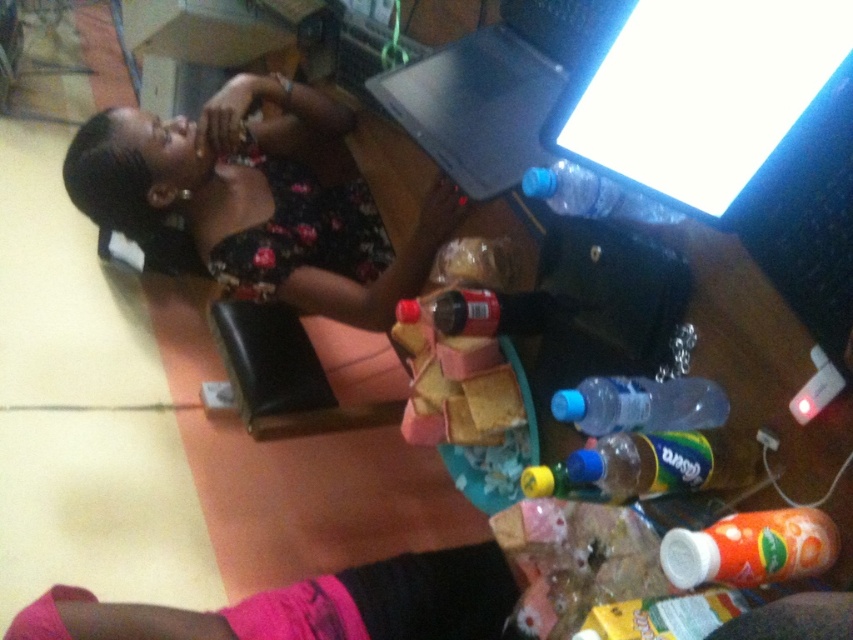
Can you confirm if black plastic laptop at upper center is positioned below transparent plastic bottle at center?

Actually, black plastic laptop at upper center is above transparent plastic bottle at center.

Who is more distant from viewer, (492, 180) or (643, 381)?

Point (492, 180)

At what (x,y) coordinates should I click in order to perform the action: click on black plastic laptop at upper center. Please return your answer as a coordinate pair (x, y). Looking at the image, I should click on (494, 90).

Who is more distant from viewer, (772, 518) or (648, 209)?

Point (648, 209)

Which is in front, point (740, 532) or point (614, 195)?

Point (740, 532) is in front.

At what (x,y) coordinates should I click in order to perform the action: click on translucent orange juice bottle at lower right. Please return your answer as a coordinate pair (x, y). The height and width of the screenshot is (640, 853). Looking at the image, I should click on (750, 548).

Does green plastic bottle at lower center have a lesser height compared to matte plastic soda bottle at center?

In fact, green plastic bottle at lower center may be taller than matte plastic soda bottle at center.

Can you confirm if green plastic bottle at lower center is positioned above matte plastic soda bottle at center?

Actually, green plastic bottle at lower center is below matte plastic soda bottle at center.

Measure the distance between point (662, 435) and camera.

30.29 inches

At what (x,y) coordinates should I click in order to perform the action: click on green plastic bottle at lower center. Please return your answer as a coordinate pair (x, y). Looking at the image, I should click on (643, 467).